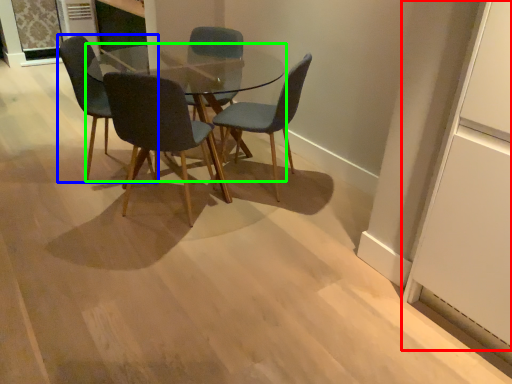
Question: Estimate the real-world distances between objects in this image. Which object is closer to glass door (highlighted by a red box), chair (highlighted by a blue box) or coffee table (highlighted by a green box)?

Choices:
 (A) chair
 (B) coffee table

Answer: (A)